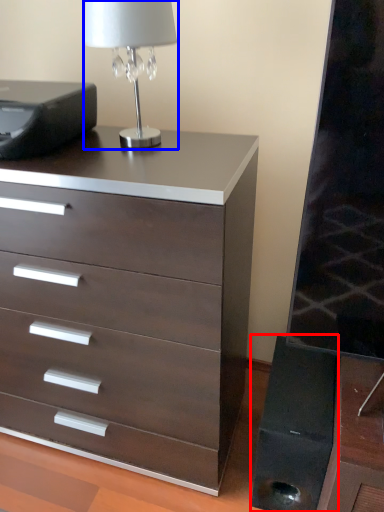
Question: Which object is further to the camera taking this photo, speaker (highlighted by a red box) or table lamp (highlighted by a blue box)?

Choices:
 (A) speaker
 (B) table lamp

Answer: (A)